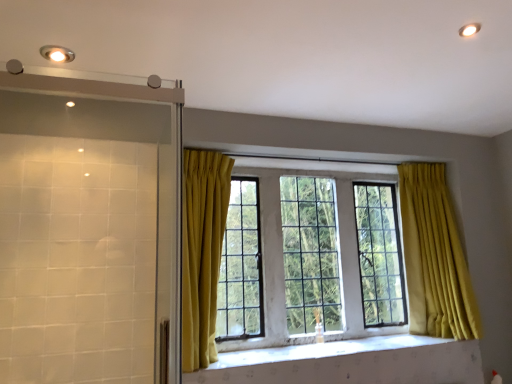
Question: Considering the relative sizes of matte silver light fixture at upper left and clear glass shower door at left in the image provided, is matte silver light fixture at upper left shorter than clear glass shower door at left?

Choices:
 (A) no
 (B) yes

Answer: (B)

Question: From the image's perspective, is matte silver light fixture at upper left located beneath clear glass shower door at left?

Choices:
 (A) no
 (B) yes

Answer: (A)

Question: Is matte silver light fixture at upper left closer to camera compared to clear glass shower door at left?

Choices:
 (A) yes
 (B) no

Answer: (B)

Question: Is matte silver light fixture at upper left positioned behind clear glass shower door at left?

Choices:
 (A) no
 (B) yes

Answer: (B)

Question: Is matte silver light fixture at upper left in contact with clear glass shower door at left?

Choices:
 (A) yes
 (B) no

Answer: (B)

Question: From the image's perspective, is white textured stone at center positioned above or below clear glass shower door at left?

Choices:
 (A) above
 (B) below

Answer: (B)

Question: Based on their sizes in the image, would you say white textured stone at center is bigger or smaller than clear glass shower door at left?

Choices:
 (A) big
 (B) small

Answer: (B)

Question: From a real-world perspective, is white textured stone at center positioned above or below clear glass shower door at left?

Choices:
 (A) below
 (B) above

Answer: (A)

Question: From their relative heights in the image, would you say white textured stone at center is taller or shorter than clear glass shower door at left?

Choices:
 (A) tall
 (B) short

Answer: (B)

Question: In terms of size, does clear glass window at center appear bigger or smaller than matte silver light fixture at upper left?

Choices:
 (A) small
 (B) big

Answer: (B)

Question: Considering the positions of point (436, 289) and point (70, 51), is point (436, 289) closer or farther from the camera than point (70, 51)?

Choices:
 (A) farther
 (B) closer

Answer: (A)

Question: From the image's perspective, is clear glass window at center above or below matte silver light fixture at upper left?

Choices:
 (A) below
 (B) above

Answer: (A)

Question: Is clear glass window at center in front of or behind matte silver light fixture at upper left in the image?

Choices:
 (A) front
 (B) behind

Answer: (B)

Question: From a real-world perspective, is clear glass window at center above or below clear glass shower door at left?

Choices:
 (A) above
 (B) below

Answer: (B)

Question: In terms of size, does clear glass window at center appear bigger or smaller than clear glass shower door at left?

Choices:
 (A) big
 (B) small

Answer: (A)